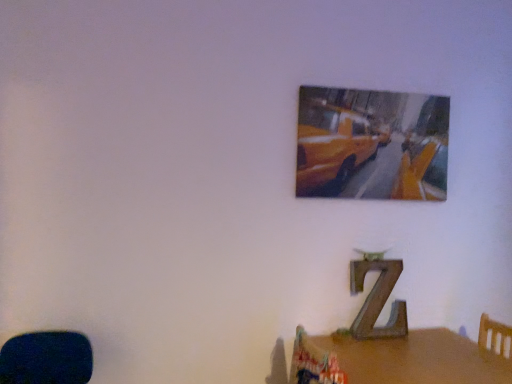
Question: Can you confirm if metallic yellow taxi at upper center is taller than brown wooden table at lower right?

Choices:
 (A) yes
 (B) no

Answer: (A)

Question: Considering the relative sizes of metallic yellow taxi at upper center and brown wooden table at lower right in the image provided, is metallic yellow taxi at upper center bigger than brown wooden table at lower right?

Choices:
 (A) no
 (B) yes

Answer: (A)

Question: From a real-world perspective, is metallic yellow taxi at upper center positioned over brown wooden table at lower right based on gravity?

Choices:
 (A) yes
 (B) no

Answer: (A)

Question: From the image's perspective, is metallic yellow taxi at upper center on top of brown wooden table at lower right?

Choices:
 (A) no
 (B) yes

Answer: (B)

Question: Is metallic yellow taxi at upper center at the right side of brown wooden table at lower right?

Choices:
 (A) yes
 (B) no

Answer: (B)

Question: From the image's perspective, is metallic yellow taxi at upper center below brown wooden table at lower right?

Choices:
 (A) yes
 (B) no

Answer: (B)

Question: Is brown wooden table at lower right smaller than metallic yellow taxi at upper center?

Choices:
 (A) no
 (B) yes

Answer: (A)

Question: Is brown wooden table at lower right wider than metallic yellow taxi at upper center?

Choices:
 (A) no
 (B) yes

Answer: (B)

Question: From a real-world perspective, is brown wooden table at lower right positioned over metallic yellow taxi at upper center based on gravity?

Choices:
 (A) yes
 (B) no

Answer: (B)

Question: Is brown wooden table at lower right not inside metallic yellow taxi at upper center?

Choices:
 (A) no
 (B) yes

Answer: (B)

Question: Is brown wooden table at lower right at the left side of metallic yellow taxi at upper center?

Choices:
 (A) no
 (B) yes

Answer: (A)

Question: From the image's perspective, would you say brown wooden table at lower right is shown under metallic yellow taxi at upper center?

Choices:
 (A) no
 (B) yes

Answer: (B)

Question: From a real-world perspective, relative to metallic yellow taxi at upper center, is brown wooden table at lower right vertically above or below?

Choices:
 (A) above
 (B) below

Answer: (B)